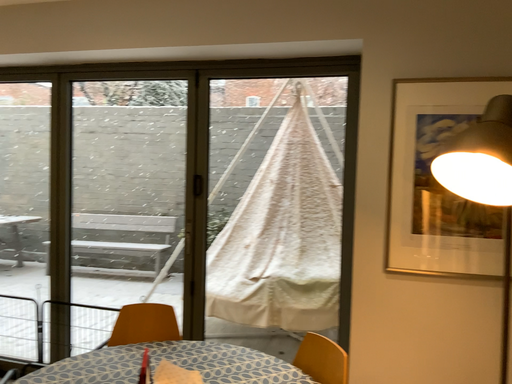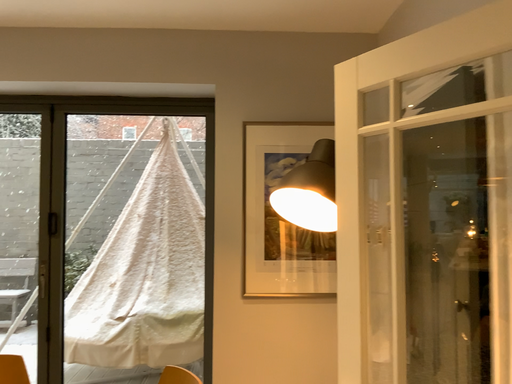
Question: Which way did the camera rotate in the video?

Choices:
 (A) rotated right
 (B) rotated left

Answer: (A)